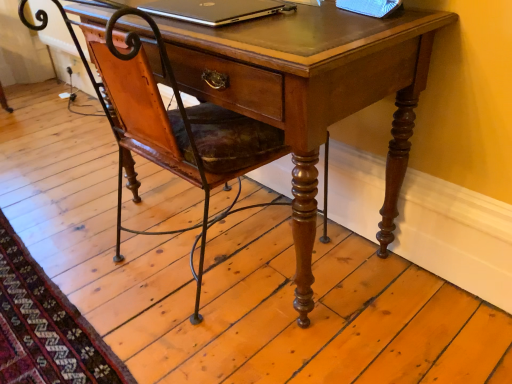
Question: From the image's perspective, is wooden desk at center above silver metallic laptop at upper center?

Choices:
 (A) no
 (B) yes

Answer: (A)

Question: From a real-world perspective, is wooden desk at center physically below silver metallic laptop at upper center?

Choices:
 (A) yes
 (B) no

Answer: (A)

Question: Does wooden desk at center have a lesser width compared to silver metallic laptop at upper center?

Choices:
 (A) no
 (B) yes

Answer: (A)

Question: Does wooden desk at center have a larger size compared to silver metallic laptop at upper center?

Choices:
 (A) no
 (B) yes

Answer: (B)

Question: Can you confirm if wooden desk at center is smaller than silver metallic laptop at upper center?

Choices:
 (A) yes
 (B) no

Answer: (B)

Question: Is wooden desk at center behind silver metallic laptop at upper center?

Choices:
 (A) no
 (B) yes

Answer: (A)

Question: Does silver metallic laptop at upper center have a smaller size compared to wooden desk at center?

Choices:
 (A) no
 (B) yes

Answer: (B)

Question: From a real-world perspective, is silver metallic laptop at upper center physically above wooden desk at center?

Choices:
 (A) no
 (B) yes

Answer: (B)

Question: Is silver metallic laptop at upper center positioned far away from wooden desk at center?

Choices:
 (A) yes
 (B) no

Answer: (B)

Question: From the image's perspective, does silver metallic laptop at upper center appear lower than wooden desk at center?

Choices:
 (A) no
 (B) yes

Answer: (A)

Question: Is silver metallic laptop at upper center positioned behind wooden desk at center?

Choices:
 (A) no
 (B) yes

Answer: (B)

Question: Does silver metallic laptop at upper center have a greater height compared to wooden desk at center?

Choices:
 (A) yes
 (B) no

Answer: (B)

Question: From the image's perspective, is silver metallic laptop at upper center positioned above or below wooden desk at center?

Choices:
 (A) above
 (B) below

Answer: (A)